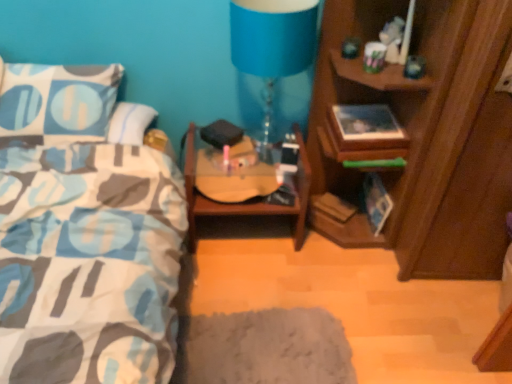
Locate an element on the screen. This screenshot has height=384, width=512. blue fabric lampshade at upper center is located at coordinates (271, 52).

Describe the element at coordinates (271, 52) in the screenshot. I see `blue fabric lampshade at upper center` at that location.

The width and height of the screenshot is (512, 384). Describe the element at coordinates (423, 135) in the screenshot. I see `wooden cabinet at right` at that location.

This screenshot has width=512, height=384. What are the coordinates of `wooden guitar case at center` in the screenshot? It's located at (246, 204).

Is blue fabric lampshade at upper center a part of wooden guitar case at center?

No, blue fabric lampshade at upper center is not inside wooden guitar case at center.

From a real-world perspective, is wooden guitar case at center physically below blue fabric lampshade at upper center?

Correct, in the physical world, wooden guitar case at center is lower than blue fabric lampshade at upper center.

Does wooden guitar case at center have a larger size compared to blue fabric lampshade at upper center?

Correct, wooden guitar case at center is larger in size than blue fabric lampshade at upper center.

Does wooden guitar case at center lie in front of blue fabric lampshade at upper center?

No.

From the picture: From a real-world perspective, which object rests below the other?

In real-world perspective, wooden cabinet at right is lower.

Considering the positions of objects blue fabric lampshade at upper center and wooden cabinet at right in the image provided, who is behind, blue fabric lampshade at upper center or wooden cabinet at right?

blue fabric lampshade at upper center is further from the camera.

Is blue fabric lampshade at upper center situated inside wooden cabinet at right or outside?

blue fabric lampshade at upper center is not inside wooden cabinet at right, it's outside.

Considering the positions of objects wooden guitar case at center and wooden cabinet at right in the image provided, who is more to the left, wooden guitar case at center or wooden cabinet at right?

wooden guitar case at center is more to the left.

Is wooden guitar case at center taller than wooden cabinet at right?

In fact, wooden guitar case at center may be shorter than wooden cabinet at right.

Is wooden guitar case at center placed right next to wooden cabinet at right?

No, wooden guitar case at center is not beside wooden cabinet at right.

Is wooden cabinet at right located outside wooden guitar case at center?

wooden cabinet at right is positioned outside wooden guitar case at center.

Does wooden cabinet at right touch wooden guitar case at center?

No, wooden cabinet at right is not in contact with wooden guitar case at center.

Which is in front, point (353, 30) or point (298, 231)?

The point (353, 30) is closer.

Is the depth of wooden cabinet at right greater than that of wooden guitar case at center?

That is False.

From a real-world perspective, is blue fabric lampshade at upper center physically located above or below wooden guitar case at center?

blue fabric lampshade at upper center is above wooden guitar case at center.

Who is smaller, blue fabric lampshade at upper center or wooden guitar case at center?

With smaller size is blue fabric lampshade at upper center.

Considering the sizes of blue fabric lampshade at upper center and wooden guitar case at center in the image, is blue fabric lampshade at upper center taller or shorter than wooden guitar case at center?

blue fabric lampshade at upper center is taller than wooden guitar case at center.

At what (x,y) coordinates should I click in order to perform the action: click on table lamp above the wooden guitar case at center (from a real-world perspective). Please return your answer as a coordinate pair (x, y). Looking at the image, I should click on (271, 52).

Based on the photo, between wooden cabinet at right and blue fabric lampshade at upper center, which one has larger size?

wooden cabinet at right.

You are a GUI agent. You are given a task and a screenshot of the screen. Output one action in this format:
    pyautogui.click(x=<x>, y=<y>)
    Task: Click on the table lamp above the wooden cabinet at right (from the image's perspective)
    The image size is (512, 384).
    Given the screenshot: What is the action you would take?
    coord(271,52)

Does point (459, 220) come behind point (269, 49)?

That is True.

Measure the distance between wooden cabinet at right and blue fabric lampshade at upper center.

wooden cabinet at right is 18.92 inches away from blue fabric lampshade at upper center.

Locate an element on the screen. table lamp in front of the wooden guitar case at center is located at coordinates (271, 52).

Identify the location of table lamp lying on the left of wooden cabinet at right. (271, 52).

When comparing their distances from wooden cabinet at right, does blue fabric lampshade at upper center or wooden guitar case at center seem closer?

Based on the image, wooden guitar case at center appears to be nearer to wooden cabinet at right.

Considering their positions, is blue fabric lampshade at upper center positioned further to wooden guitar case at center than wooden cabinet at right?

The object further to wooden guitar case at center is blue fabric lampshade at upper center.

Considering their positions, is wooden guitar case at center positioned closer to wooden cabinet at right than blue fabric lampshade at upper center?

wooden guitar case at center.

From the image, which object appears to be farther from blue fabric lampshade at upper center, wooden cabinet at right or wooden guitar case at center?

wooden cabinet at right is positioned further to the anchor blue fabric lampshade at upper center.

Looking at the image, which one is located closer to blue fabric lampshade at upper center, wooden guitar case at center or wooden cabinet at right?

wooden guitar case at center is positioned closer to the anchor blue fabric lampshade at upper center.

Considering their positions, is wooden cabinet at right positioned closer to wooden guitar case at center than blue fabric lampshade at upper center?

The object closer to wooden guitar case at center is wooden cabinet at right.

Locate an element on the screen. The width and height of the screenshot is (512, 384). table lamp between wooden guitar case at center and wooden cabinet at right in the horizontal direction is located at coordinates pyautogui.click(x=271, y=52).